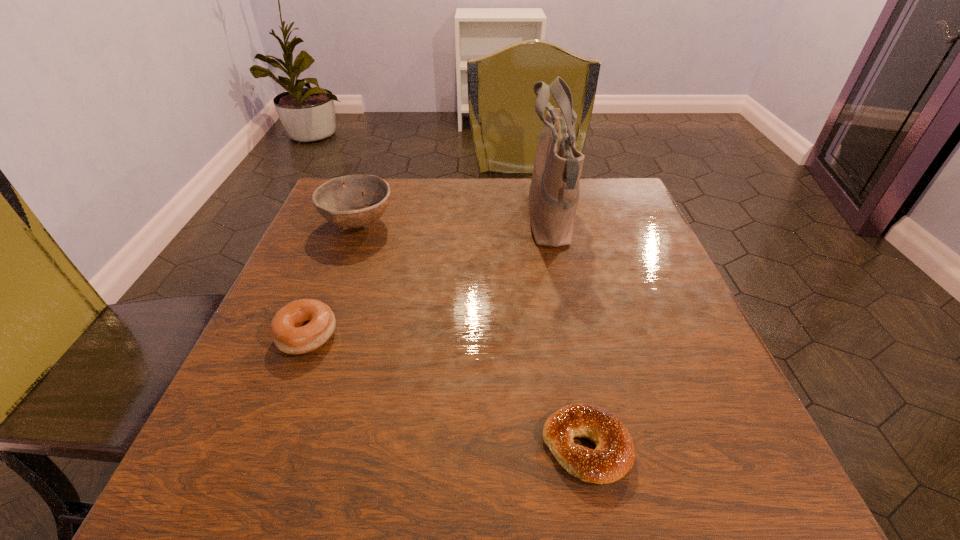
Locate an element on the screen. The width and height of the screenshot is (960, 540). vacant area situated 0.250m on the back of the taller bagel is located at coordinates (347, 235).

At what (x,y) coordinates should I click in order to perform the action: click on vacant space located 0.080m on the right of the right bagel. Please return your answer as a coordinate pair (x, y). The width and height of the screenshot is (960, 540). Looking at the image, I should click on (686, 447).

Find the location of a particular element. This screenshot has width=960, height=540. shoulder bag present at the far edge is located at coordinates (554, 191).

The height and width of the screenshot is (540, 960). In order to click on bowl located in the far edge section of the desktop in this screenshot , I will do `click(341, 200)`.

This screenshot has width=960, height=540. Find the location of `object situated at the near edge`. object situated at the near edge is located at coordinates (614, 455).

At what (x,y) coordinates should I click in order to perform the action: click on bowl present at the left edge. Please return your answer as a coordinate pair (x, y). This screenshot has width=960, height=540. Looking at the image, I should click on (341, 200).

The width and height of the screenshot is (960, 540). Find the location of `bagel that is at the left edge`. bagel that is at the left edge is located at coordinates (301, 326).

Locate an element on the screen. The image size is (960, 540). object present at the far left corner is located at coordinates (341, 200).

In the image, there is a desktop. What are the coordinates of `vacant area at the far edge` in the screenshot? It's located at (495, 198).

Identify the location of free space at the near edge of the desktop. The width and height of the screenshot is (960, 540). (515, 488).